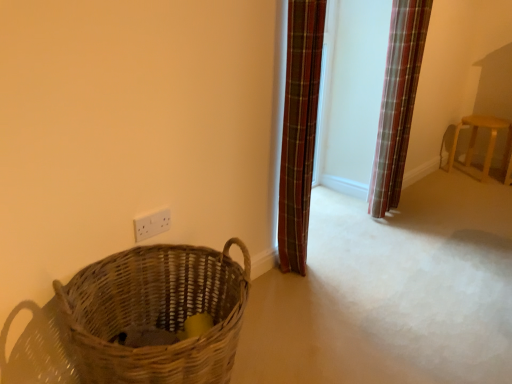
Locate an element on the screen. The height and width of the screenshot is (384, 512). empty space that is to the right of woven brown basket at lower left is located at coordinates (309, 345).